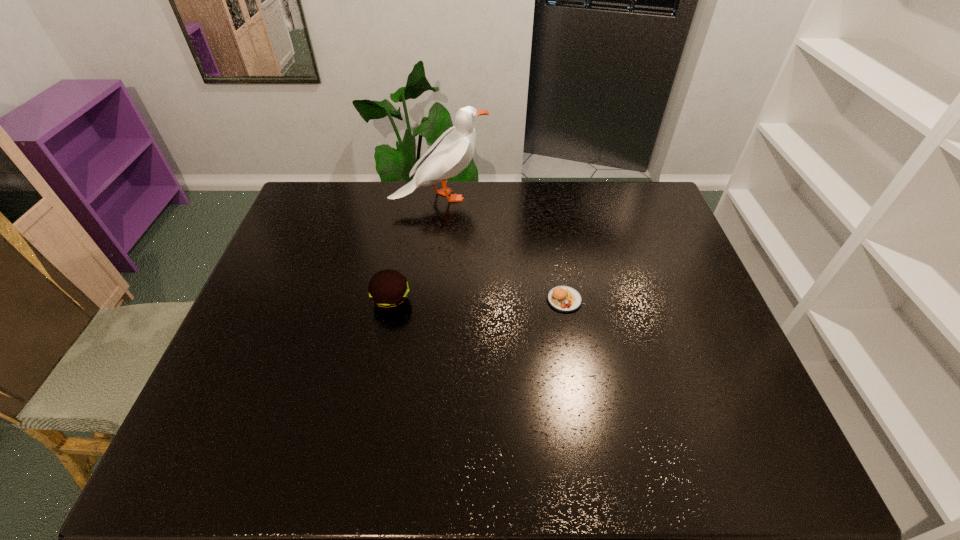
Where is `unoccupied position between the gull and the shortest object`? The width and height of the screenshot is (960, 540). unoccupied position between the gull and the shortest object is located at coordinates (502, 248).

Identify the location of empty location between the tallest object and the left patty. Image resolution: width=960 pixels, height=540 pixels. (416, 249).

This screenshot has width=960, height=540. Identify the location of empty space that is in between the rightmost object and the farthest object. (502, 248).

Image resolution: width=960 pixels, height=540 pixels. I want to click on empty space that is in between the second shortest object and the gull, so click(416, 249).

Locate an element on the screen. The height and width of the screenshot is (540, 960). free space between the gull and the rightmost object is located at coordinates (502, 248).

This screenshot has width=960, height=540. Identify the location of object that is the closest to the second tallest object. (451, 153).

You are a GUI agent. You are given a task and a screenshot of the screen. Output one action in this format:
    pyautogui.click(x=<x>, y=<y>)
    Task: Click on the closest object to the second tallest object
    This screenshot has width=960, height=540.
    Given the screenshot: What is the action you would take?
    pyautogui.click(x=451, y=153)

Find the location of a particular element. This screenshot has height=540, width=960. free point that satisfies the following two spatial constraints: 1. at the beak of the tallest object; 2. on the front side of the second tallest object is located at coordinates (430, 301).

The width and height of the screenshot is (960, 540). Find the location of `free point that satisfies the following two spatial constraints: 1. on the back side of the right patty; 2. at the beak of the gull`. free point that satisfies the following two spatial constraints: 1. on the back side of the right patty; 2. at the beak of the gull is located at coordinates (546, 197).

The height and width of the screenshot is (540, 960). In order to click on free space that satisfies the following two spatial constraints: 1. on the back side of the rightmost object; 2. at the beak of the farthest object in this screenshot , I will do `click(546, 197)`.